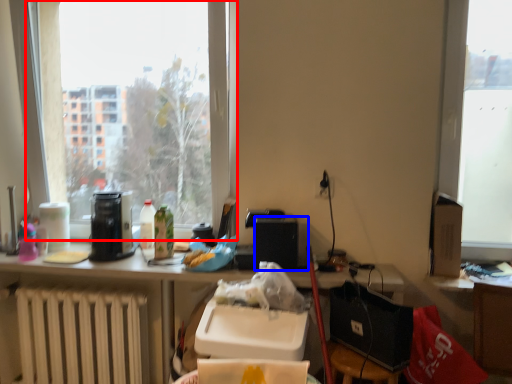
Question: Among these objects, which one is nearest to the camera, window (highlighted by a red box) or loudspeaker (highlighted by a blue box)?

Choices:
 (A) window
 (B) loudspeaker

Answer: (B)